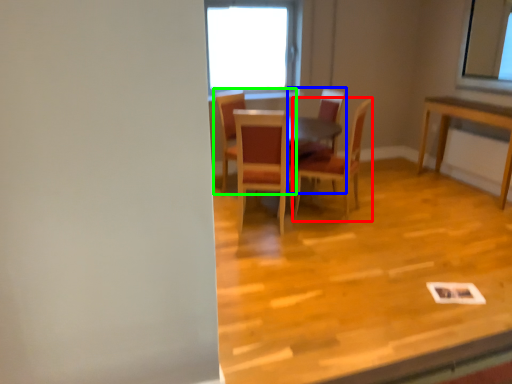
Question: Considering the real-world distances, which object is farthest from chair (highlighted by a red box)? chair (highlighted by a blue box) or chair (highlighted by a green box)?

Choices:
 (A) chair
 (B) chair

Answer: (A)